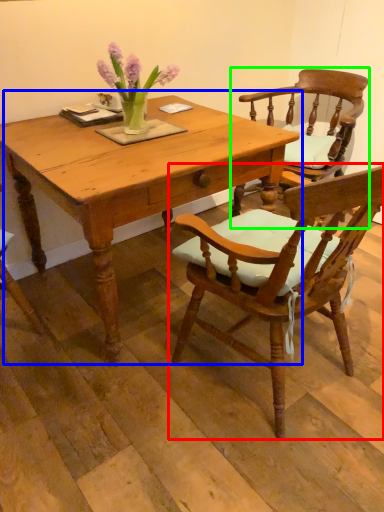
Question: Which is farther away from chair (highlighted by a red box)? table (highlighted by a blue box) or chair (highlighted by a green box)?

Choices:
 (A) table
 (B) chair

Answer: (B)